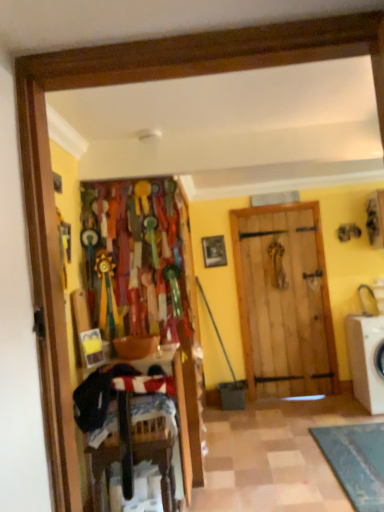
Question: From the image's perspective, is white plastic washing machine at right located above wooden picture frame at center?

Choices:
 (A) yes
 (B) no

Answer: (B)

Question: Does white plastic washing machine at right have a lesser height compared to wooden picture frame at center?

Choices:
 (A) yes
 (B) no

Answer: (B)

Question: From a real-world perspective, is white plastic washing machine at right located higher than wooden picture frame at center?

Choices:
 (A) no
 (B) yes

Answer: (A)

Question: Does white plastic washing machine at right have a larger size compared to wooden picture frame at center?

Choices:
 (A) no
 (B) yes

Answer: (B)

Question: From the image's perspective, is white plastic washing machine at right located beneath wooden picture frame at center?

Choices:
 (A) no
 (B) yes

Answer: (B)

Question: Considering the relative positions of white plastic washing machine at right and wooden picture frame at center in the image provided, is white plastic washing machine at right to the right of wooden picture frame at center from the viewer's perspective?

Choices:
 (A) yes
 (B) no

Answer: (A)

Question: Is wooden picture frame at center outside of white plastic washing machine at right?

Choices:
 (A) no
 (B) yes

Answer: (B)

Question: Considering the relative positions of wooden picture frame at center and white plastic washing machine at right in the image provided, is wooden picture frame at center to the left of white plastic washing machine at right from the viewer's perspective?

Choices:
 (A) yes
 (B) no

Answer: (A)

Question: From a real-world perspective, is wooden picture frame at center on white plastic washing machine at right?

Choices:
 (A) yes
 (B) no

Answer: (A)

Question: Is wooden picture frame at center behind white plastic washing machine at right?

Choices:
 (A) no
 (B) yes

Answer: (B)

Question: Does wooden picture frame at center have a greater height compared to white plastic washing machine at right?

Choices:
 (A) yes
 (B) no

Answer: (B)

Question: From a real-world perspective, is wooden picture frame at center physically below white plastic washing machine at right?

Choices:
 (A) yes
 (B) no

Answer: (B)

Question: Can you confirm if dark blue fabric laundry at lower left is smaller than white plastic washing machine at right?

Choices:
 (A) no
 (B) yes

Answer: (B)